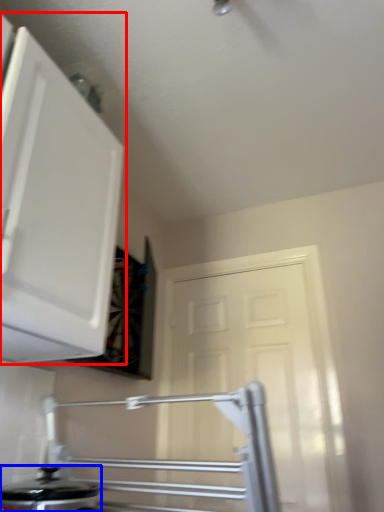
Question: Which object appears closest to the camera in this image, cabinetry (highlighted by a red box) or kitchen appliance (highlighted by a blue box)?

Choices:
 (A) cabinetry
 (B) kitchen appliance

Answer: (A)